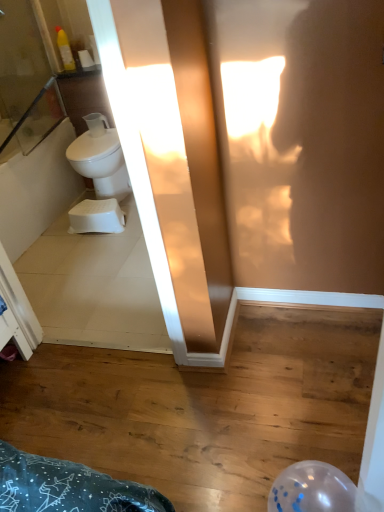
Question: In terms of size, does white matte toilet paper at upper left appear bigger or smaller than white plastic step stool at lower left?

Choices:
 (A) big
 (B) small

Answer: (B)

Question: Which is correct: white matte toilet paper at upper left is inside white plastic step stool at lower left, or outside of it?

Choices:
 (A) inside
 (B) outside

Answer: (B)

Question: Which of these objects is positioned farthest from the white plastic step stool at lower left?

Choices:
 (A) white glossy toilet at left
 (B) clear glass screen door at upper left
 (C) white matte toilet paper at upper left

Answer: (C)

Question: Which object is positioned farthest from the white matte toilet paper at upper left?

Choices:
 (A) clear glass screen door at upper left
 (B) white plastic step stool at lower left
 (C) white glossy toilet at left

Answer: (B)